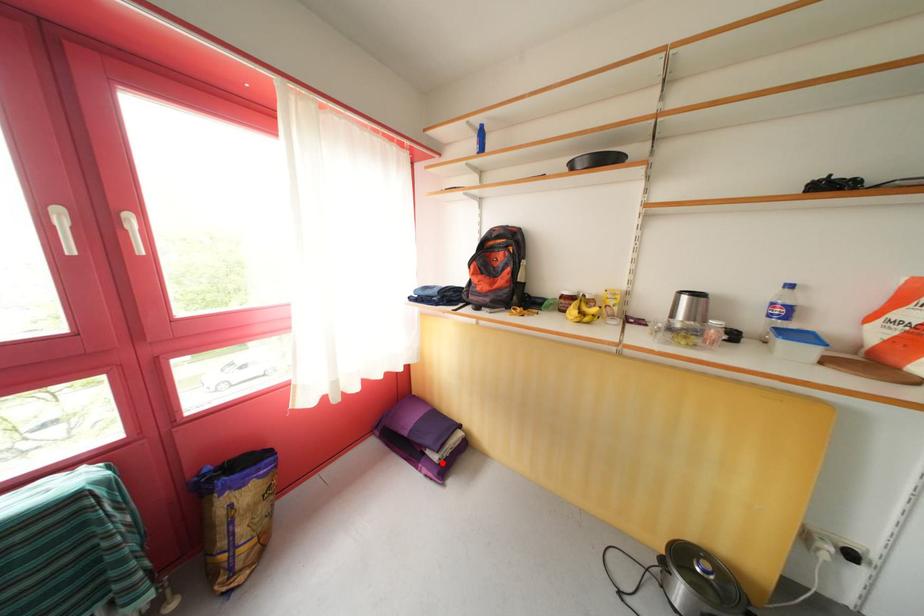
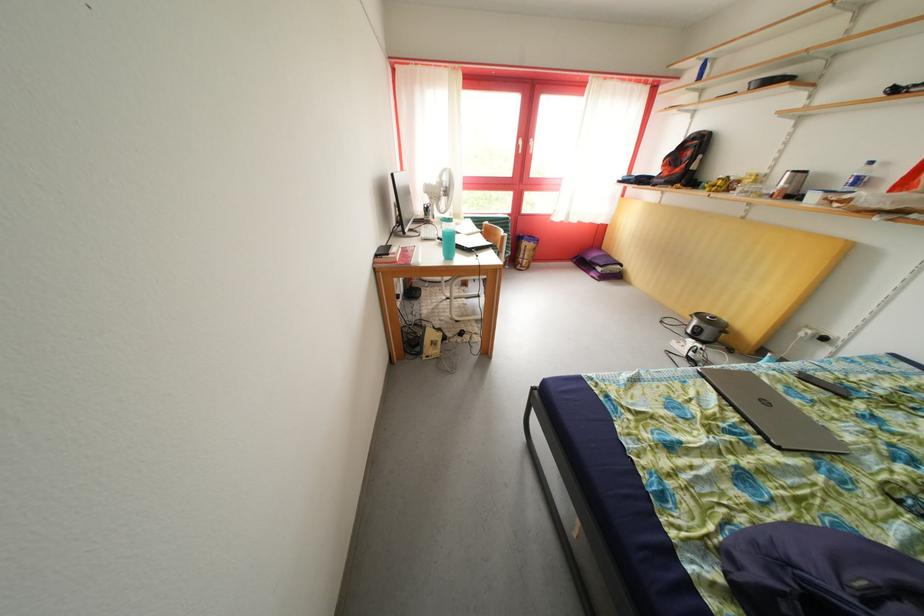
Question: I am providing you with two images of the same scene from different viewpoints. Given a red point in image1, look at the same physical point in image2. Is it:

Choices:
 (A) Closer to the viewpoint
 (B) Farther from the viewpoint

Answer: (A)